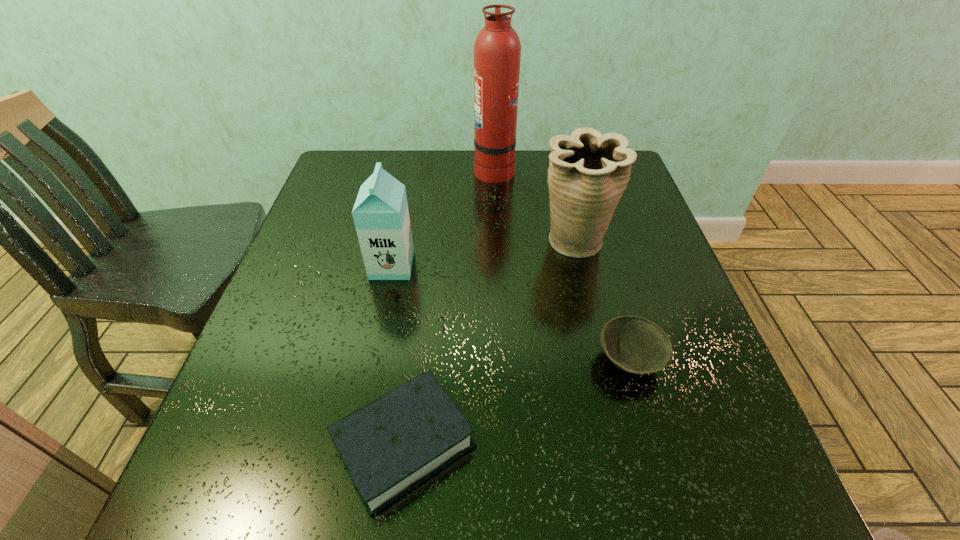
This screenshot has height=540, width=960. Find the location of `vacant space at the right edge of the desktop`. vacant space at the right edge of the desktop is located at coordinates (649, 242).

The image size is (960, 540). What are the coordinates of `free point between the bowl and the urn` in the screenshot? It's located at (601, 301).

You are a GUI agent. You are given a task and a screenshot of the screen. Output one action in this format:
    pyautogui.click(x=<x>, y=<y>)
    Task: Click on the free area in between the urn and the bowl
    The width and height of the screenshot is (960, 540).
    Given the screenshot: What is the action you would take?
    pyautogui.click(x=601, y=301)

The image size is (960, 540). In order to click on free space between the bowl and the Bible in this screenshot , I will do `click(516, 401)`.

Identify the location of vacant area between the urn and the farthest object. (534, 206).

Find the location of a particular element. The width and height of the screenshot is (960, 540). empty space between the milk carton and the urn is located at coordinates (483, 254).

The image size is (960, 540). In order to click on vacant space that is in between the fire extinguisher and the urn in this screenshot , I will do click(534, 206).

This screenshot has width=960, height=540. I want to click on unoccupied position between the tallest object and the urn, so click(534, 206).

Identify the location of free space that is in between the Bible and the tallest object. (449, 306).

The height and width of the screenshot is (540, 960). I want to click on free space between the urn and the fire extinguisher, so click(534, 206).